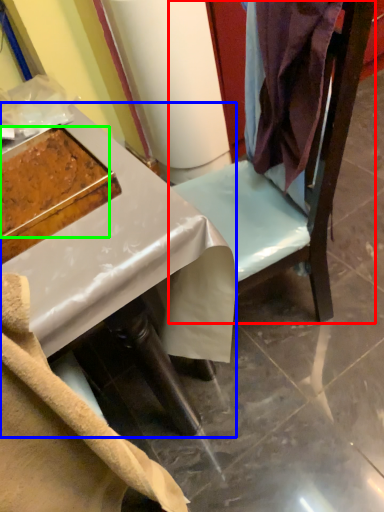
Question: Which object is positioned closest to furniture (highlighted by a red box)? Select from desk (highlighted by a blue box) and food (highlighted by a green box).

Choices:
 (A) desk
 (B) food

Answer: (A)